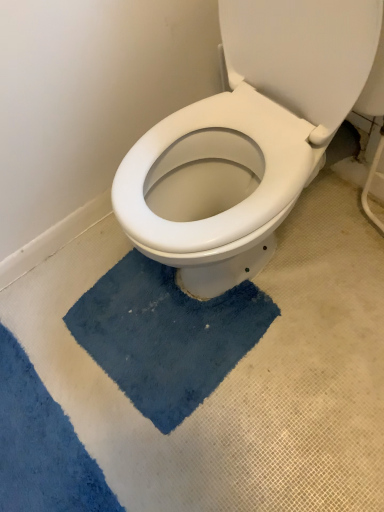
Question: In terms of height, does blue plush bath mat at center, which is the second bath mat in left-to-right order, look taller or shorter compared to blue plush bath mat at lower center, marked as the 2th bath mat in a right-to-left arrangement?

Choices:
 (A) short
 (B) tall

Answer: (A)

Question: Looking at the image, does blue plush bath mat at center, which is the second bath mat in left-to-right order, seem bigger or smaller compared to blue plush bath mat at lower center, marked as the 2th bath mat in a right-to-left arrangement?

Choices:
 (A) big
 (B) small

Answer: (A)

Question: From a real-world perspective, relative to blue plush bath mat at lower center, marked as the 2th bath mat in a right-to-left arrangement, is blue plush bath mat at center, acting as the first bath mat starting from the right, vertically above or below?

Choices:
 (A) above
 (B) below

Answer: (B)

Question: Is blue plush bath mat at lower center, marked as the 2th bath mat in a right-to-left arrangement, wider or thinner than blue plush bath mat at center, which is the second bath mat in left-to-right order?

Choices:
 (A) wide
 (B) thin

Answer: (B)

Question: Is point (1, 361) closer or farther from the camera than point (112, 326)?

Choices:
 (A) farther
 (B) closer

Answer: (B)

Question: From the image's perspective, is blue plush bath mat at lower center, marked as the 2th bath mat in a right-to-left arrangement, above or below blue plush bath mat at center, which is the second bath mat in left-to-right order?

Choices:
 (A) below
 (B) above

Answer: (A)

Question: Is blue plush bath mat at lower center, marked as the 2th bath mat in a right-to-left arrangement, in front of or behind blue plush bath mat at center, which is the second bath mat in left-to-right order, in the image?

Choices:
 (A) behind
 (B) front

Answer: (B)